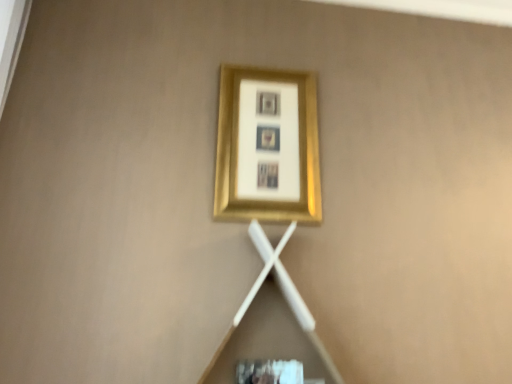
Locate an element on the screen. The width and height of the screenshot is (512, 384). gold metallic picture frame at upper center is located at coordinates (267, 146).

What do you see at coordinates (267, 146) in the screenshot?
I see `gold metallic picture frame at upper center` at bounding box center [267, 146].

The height and width of the screenshot is (384, 512). Find the location of `gold metallic picture frame at upper center`. gold metallic picture frame at upper center is located at coordinates click(x=267, y=146).